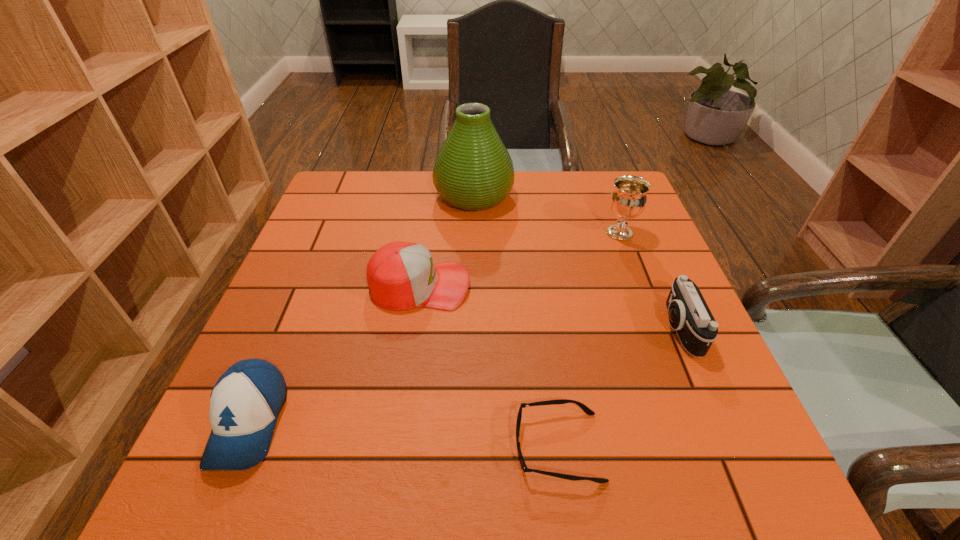
This screenshot has width=960, height=540. What are the coordinates of `vacant area situated on the left of the chalice` in the screenshot? It's located at (584, 233).

Identify the location of blank space located 0.350m on the front-facing side of the farther baseball cap. (620, 286).

Find the location of a particular element. Image resolution: width=960 pixels, height=540 pixels. free space located on the front lens of the camera is located at coordinates (612, 329).

I want to click on blank space located 0.260m on the front lens of the camera, so click(540, 329).

What are the coordinates of `free space located on the front lens of the camera` in the screenshot? It's located at (588, 329).

Where is `free space located 0.280m on the front-facing side of the spectacles`? The width and height of the screenshot is (960, 540). free space located 0.280m on the front-facing side of the spectacles is located at coordinates (348, 447).

Locate an element on the screen. vacant area situated 0.200m on the front-facing side of the spectacles is located at coordinates (396, 447).

Identify the location of vacant space located 0.120m on the front-facing side of the spectacles. This screenshot has width=960, height=540. (444, 447).

This screenshot has height=540, width=960. What are the coordinates of `object that is at the far edge` in the screenshot? It's located at (473, 171).

Find the location of a particular element. The width and height of the screenshot is (960, 540). baseball cap located in the near edge section of the desktop is located at coordinates (245, 402).